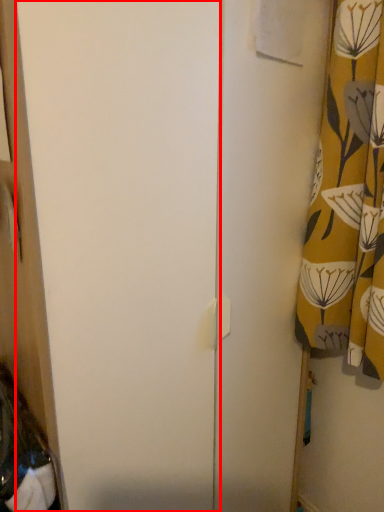
Question: In this image, where is screen door (annotated by the red box) located relative to curtain?

Choices:
 (A) right
 (B) left

Answer: (B)